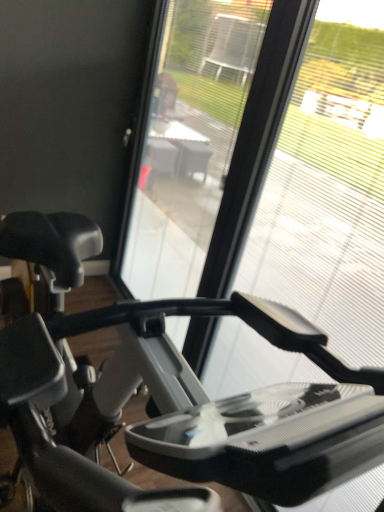
This screenshot has height=512, width=384. Describe the element at coordinates (166, 392) in the screenshot. I see `matte black stationary bicycle at left` at that location.

Where is `transparent plastic screen door at center`? This screenshot has height=512, width=384. transparent plastic screen door at center is located at coordinates (190, 142).

Looking at this image, from a real-world perspective, relative to transparent plastic screen door at center, is transparent plastic glass at center vertically above or below?

transparent plastic glass at center is above transparent plastic screen door at center.

In terms of size, does transparent plastic glass at center appear bigger or smaller than transparent plastic screen door at center?

In the image, transparent plastic glass at center appears to be smaller than transparent plastic screen door at center.

Is transparent plastic glass at center turned away from transparent plastic screen door at center?

No, transparent plastic glass at center is not facing the opposite direction of transparent plastic screen door at center.

Considering the sizes of objects transparent plastic glass at center and matte black stationary bicycle at left in the image provided, who is shorter, transparent plastic glass at center or matte black stationary bicycle at left?

matte black stationary bicycle at left.

Is transparent plastic glass at center looking in the opposite direction of matte black stationary bicycle at left?

Yes, transparent plastic glass at center is positioned with its back facing matte black stationary bicycle at left.

From the image's perspective, is transparent plastic glass at center on top of matte black stationary bicycle at left?

Correct, transparent plastic glass at center appears higher than matte black stationary bicycle at left in the image.

Which point is more distant from viewer, (316, 106) or (33, 442)?

The point (316, 106) is behind.

The height and width of the screenshot is (512, 384). In order to click on glass window lying above the matte black stationary bicycle at left (from the image's perspective) in this screenshot , I will do `click(328, 192)`.

Is matte black stationary bicycle at left inside the boundaries of transparent plastic glass at center, or outside?

matte black stationary bicycle at left is not enclosed by transparent plastic glass at center.

Is the surface of matte black stationary bicycle at left in direct contact with transparent plastic glass at center?

matte black stationary bicycle at left and transparent plastic glass at center are not in contact.

Between point (72, 232) and point (328, 11), which one is positioned in front?

The point (72, 232) is closer to the camera.

Between transparent plastic screen door at center and matte black stationary bicycle at left, which one has more height?

With more height is transparent plastic screen door at center.

Is transparent plastic screen door at center inside the boundaries of matte black stationary bicycle at left, or outside?

The correct answer is: outside.

Is the surface of transparent plastic screen door at center in direct contact with matte black stationary bicycle at left?

transparent plastic screen door at center and matte black stationary bicycle at left are not in contact.

Is transparent plastic screen door at center behind matte black stationary bicycle at left?

Yes, transparent plastic screen door at center is further from the camera.

Considering the sizes of objects transparent plastic screen door at center and transparent plastic glass at center in the image provided, who is bigger, transparent plastic screen door at center or transparent plastic glass at center?

Bigger between the two is transparent plastic screen door at center.

Can you confirm if transparent plastic screen door at center is taller than transparent plastic glass at center?

Yes.

In the scene shown: Which of these two, transparent plastic screen door at center or transparent plastic glass at center, is wider?

With larger width is transparent plastic screen door at center.

Considering the sizes of matte black stationary bicycle at left and transparent plastic screen door at center in the image, is matte black stationary bicycle at left taller or shorter than transparent plastic screen door at center?

Considering their sizes, matte black stationary bicycle at left has less height than transparent plastic screen door at center.

Looking at the image, does matte black stationary bicycle at left seem bigger or smaller compared to transparent plastic screen door at center?

In the image, matte black stationary bicycle at left appears to be larger than transparent plastic screen door at center.

Image resolution: width=384 pixels, height=512 pixels. Identify the location of stationary bicycle lying below the transparent plastic screen door at center (from the image's perspective). (166, 392).

Considering the positions of objects matte black stationary bicycle at left and transparent plastic screen door at center in the image provided, who is more to the right, matte black stationary bicycle at left or transparent plastic screen door at center?

transparent plastic screen door at center.

This screenshot has width=384, height=512. Identify the location of screen door that appears above the transparent plastic glass at center (from the image's perspective). (190, 142).

At what (x,y) coordinates should I click in order to perform the action: click on stationary bicycle below the transparent plastic glass at center (from the image's perspective). Please return your answer as a coordinate pair (x, y). The image size is (384, 512). Looking at the image, I should click on (166, 392).

When comparing their distances from transparent plastic glass at center, does transparent plastic screen door at center or matte black stationary bicycle at left seem closer?

Among the two, transparent plastic screen door at center is located nearer to transparent plastic glass at center.

Estimate the real-world distances between objects in this image. Which object is closer to matte black stationary bicycle at left, transparent plastic screen door at center or transparent plastic glass at center?

transparent plastic glass at center.

Which object lies further to the anchor point matte black stationary bicycle at left, transparent plastic glass at center or transparent plastic screen door at center?

Based on the image, transparent plastic screen door at center appears to be further to matte black stationary bicycle at left.

Which object lies nearer to the anchor point transparent plastic screen door at center, matte black stationary bicycle at left or transparent plastic glass at center?

transparent plastic glass at center is positioned closer to the anchor transparent plastic screen door at center.

Based on their spatial positions, is matte black stationary bicycle at left or transparent plastic screen door at center further from transparent plastic glass at center?

matte black stationary bicycle at left lies further to transparent plastic glass at center than the other object.

Looking at the image, which one is located closer to transparent plastic screen door at center, transparent plastic glass at center or matte black stationary bicycle at left?

transparent plastic glass at center.

The image size is (384, 512). I want to click on glass window between matte black stationary bicycle at left and transparent plastic screen door at center in the front-back direction, so 328,192.